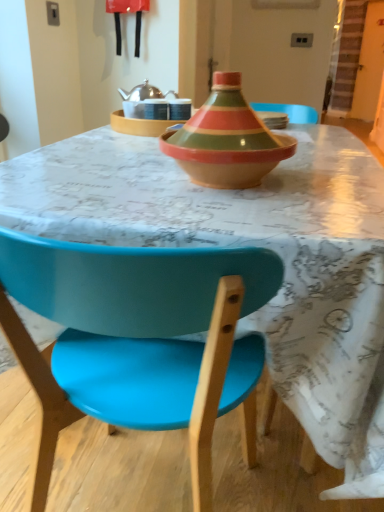
Locate an element on the screen. matte blue chair at center is located at coordinates (138, 339).

What do you see at coordinates (138, 339) in the screenshot?
I see `matte blue chair at center` at bounding box center [138, 339].

The width and height of the screenshot is (384, 512). In order to click on matte blue chair at center in this screenshot , I will do `click(138, 339)`.